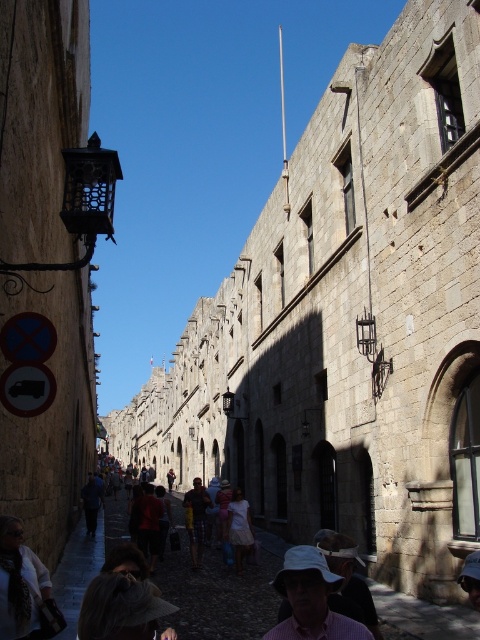
You are a tourist standing at the entrance of the historic street scene in Greece. You notice a person wearing a pink checkered shirt at lower center. If you want to take a photo of them without including the arched doorway behind them, which is located at point 0.8, 0.7, should you move left or right?

The pink checkered shirt at lower center is located at point (314,600). The arched doorway is at (336,512). Since the shirt is to the right and slightly below the doorway, moving to the right would position the shirt away from the doorway, allowing you to frame the photo without including the doorway.

You are a photographer standing on a historic European street lined with stone buildings. You notice two people wearing a pink checkered shirt at lower center and a white textured shirt at lower left. Which person is taller?

The pink checkered shirt at lower center is taller than the white textured shirt at lower left, so the person wearing the pink checkered shirt at lower center is taller.